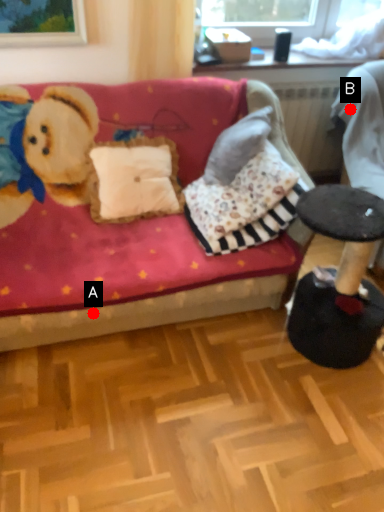
Question: Two points are circled on the image, labeled by A and B beside each circle. Among these points, which one is nearest to the camera?

Choices:
 (A) A is closer
 (B) B is closer

Answer: (A)